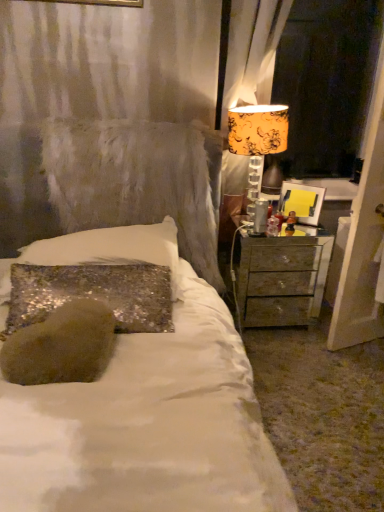
Locate an element on the screen. vacant area that is in front of metallic silver nightstand at right is located at coordinates (287, 356).